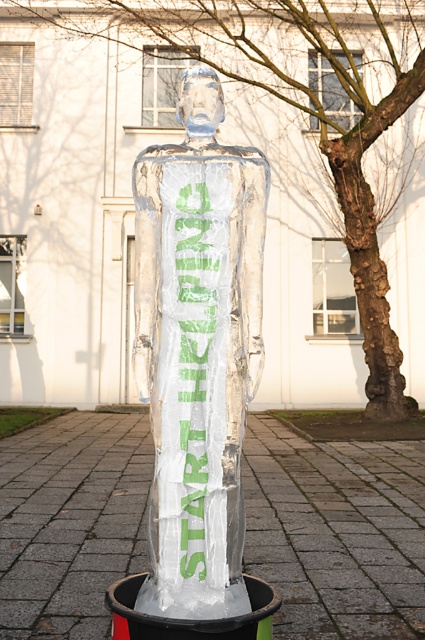
Question: Which object is closer to the camera taking this photo?

Choices:
 (A) bark textured tree at center right
 (B) transparent ice sculpture at center
 (C) clear ice figure at center
 (D) green translucent ice at center

Answer: (C)

Question: Considering the real-world distances, which object is farthest from the clear ice figure at center?

Choices:
 (A) green translucent ice at center
 (B) bark textured tree at center right
 (C) transparent ice sculpture at center

Answer: (B)

Question: Can you confirm if transparent ice sculpture at center is positioned to the left of clear ice figure at center?

Choices:
 (A) yes
 (B) no

Answer: (B)

Question: Is bark textured tree at center right to the right of transparent ice sculpture at center from the viewer's perspective?

Choices:
 (A) yes
 (B) no

Answer: (B)

Question: Considering the real-world distances, which object is farthest from the bark textured tree at center right?

Choices:
 (A) clear ice figure at center
 (B) green translucent ice at center

Answer: (B)

Question: Is bark textured tree at center right above transparent ice sculpture at center?

Choices:
 (A) yes
 (B) no

Answer: (A)